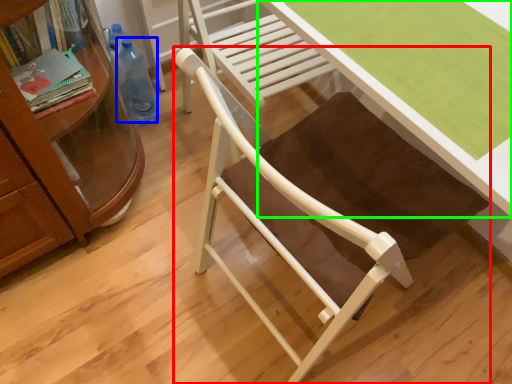
Question: Considering the real-world distances, which object is closest to chair (highlighted by a red box)? bottle (highlighted by a blue box) or desk (highlighted by a green box).

Choices:
 (A) bottle
 (B) desk

Answer: (B)